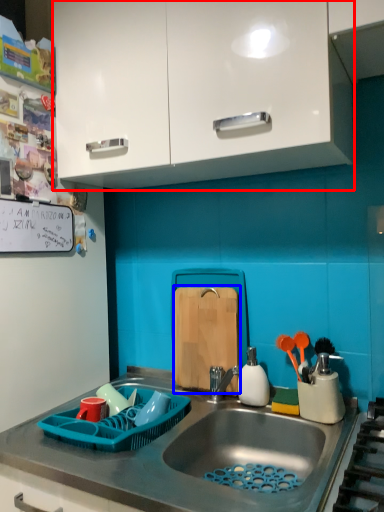
Question: Among these objects, which one is farthest to the camera, cabinetry (highlighted by a red box) or cutting board (highlighted by a blue box)?

Choices:
 (A) cabinetry
 (B) cutting board

Answer: (B)